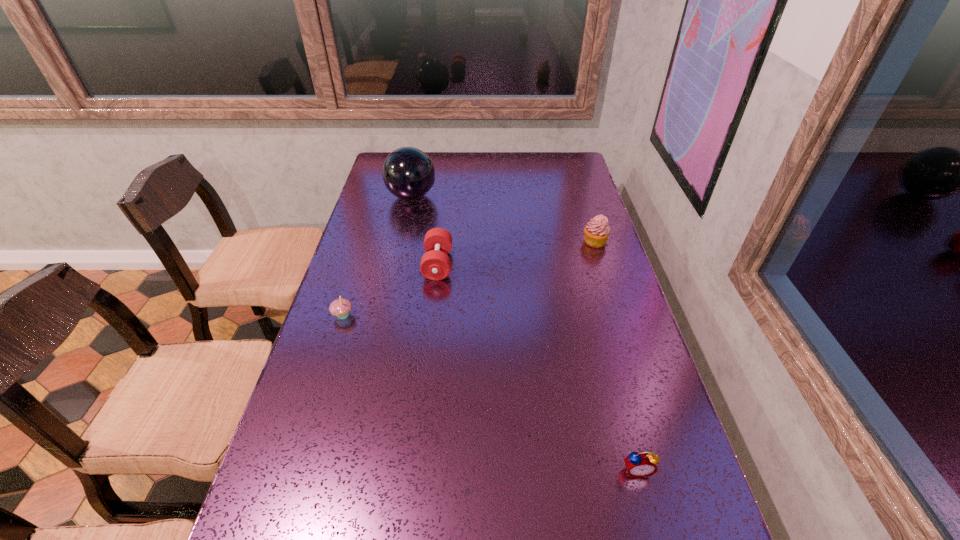
The width and height of the screenshot is (960, 540). In the image, there is a desktop. Find the location of `vacant space at the far right corner`. vacant space at the far right corner is located at coordinates (570, 169).

Identify the location of free space between the dumbbell and the shorter cupcake. This screenshot has height=540, width=960. (391, 290).

You are a GUI agent. You are given a task and a screenshot of the screen. Output one action in this format:
    pyautogui.click(x=<x>, y=<y>)
    Task: Click on the empty location between the farther cupcake and the bowling ball
    The image size is (960, 540).
    Given the screenshot: What is the action you would take?
    pyautogui.click(x=503, y=219)

Where is `blank region between the left cupcake and the farthest object`? The image size is (960, 540). blank region between the left cupcake and the farthest object is located at coordinates (377, 256).

Find the location of a particular element. The height and width of the screenshot is (540, 960). free space between the dumbbell and the farthest object is located at coordinates (424, 231).

Where is `empty location between the dumbbell and the alarm clock`? This screenshot has width=960, height=540. empty location between the dumbbell and the alarm clock is located at coordinates (538, 367).

Where is `free space between the farther cupcake and the nearest object`? free space between the farther cupcake and the nearest object is located at coordinates (615, 356).

This screenshot has width=960, height=540. In order to click on vacant space in between the alarm clock and the farther cupcake in this screenshot , I will do `click(615, 356)`.

I want to click on free space between the farthest object and the taller cupcake, so click(503, 219).

Image resolution: width=960 pixels, height=540 pixels. I want to click on blank region between the right cupcake and the alarm clock, so click(x=615, y=356).